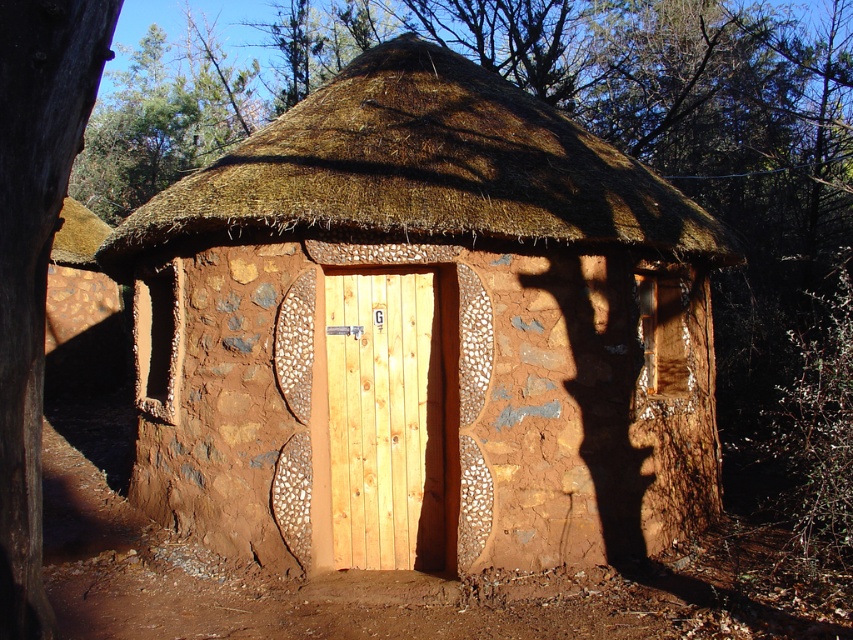
Can you confirm if brown textured mud hut at center is positioned above brown thatch at upper center?

No.

Which is behind, point (192, 333) or point (358, 227)?

The point (192, 333) is behind.

Who is more distant from viewer, (589, 188) or (236, 173)?

A: Positioned behind is point (236, 173).

You are a GUI agent. You are given a task and a screenshot of the screen. Output one action in this format:
    pyautogui.click(x=<x>, y=<y>)
    Task: Click on the brown textured mud hut at center
    
    Given the screenshot: What is the action you would take?
    pyautogui.click(x=422, y=333)

Is point (404, 90) behind point (335, 550)?

Yes.

Consider the image. Does brown textured mud hut at center appear under light brown wood door at center?

No, brown textured mud hut at center is not below light brown wood door at center.

Between point (213, 502) and point (355, 316), which one is positioned behind?

The point (213, 502) is behind.

This screenshot has width=853, height=640. What are the coordinates of `brown textured mud hut at center` in the screenshot? It's located at (422, 333).

Consider the image. Can you confirm if brown thatch at upper center is bigger than light brown wood door at center?

Indeed, brown thatch at upper center has a larger size compared to light brown wood door at center.

Locate an element on the screen. The image size is (853, 640). brown thatch at upper center is located at coordinates (425, 168).

The image size is (853, 640). What are the coordinates of `brown thatch at upper center` in the screenshot? It's located at (425, 168).